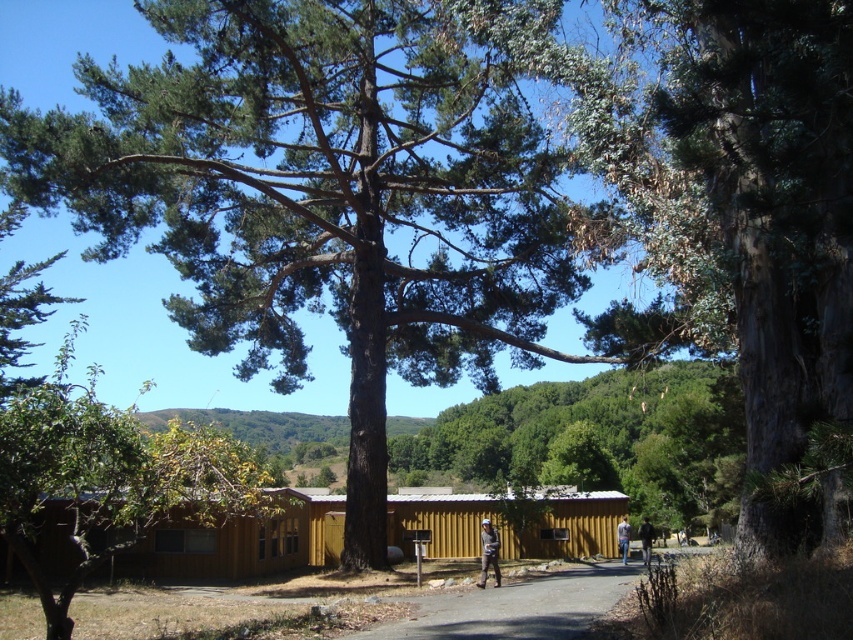
From the picture: You are planning to place a 3m wide picnic blanket between the green textured tree at center and the gray asphalt path at center. Based on their widths, can the blanket fit entirely within the space between them?

The green textured tree at center is wider than the gray asphalt path at center. Since the tree is wider, the space between them might be narrower than the path itself. However, without exact measurements of the gap, it is uncertain if the 3m wide picnic blanket can fit entirely within the space between them. The provided information only states the relative widths of the objects, not the distance between them.

You are standing at the base of the large pine tree in the foreground. You want to walk to the wooden cabin at center. Is the gray asphalt path at center closer to you than the cabin?

The wooden cabin at center is 26.08 feet away from the gray asphalt path at center. Since you are at the base of the pine tree in the foreground, the cabin and the path are both in the mid and background. The path is closer to you than the cabin because it is only 26.08 feet away from the cabin, but your position at the tree is in the foreground, so the path is nearer than the cabin.